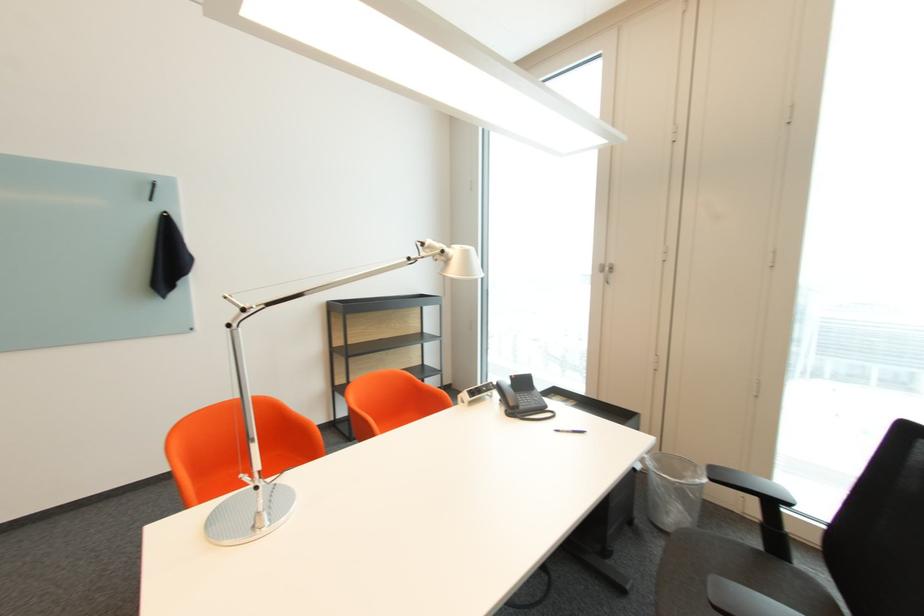
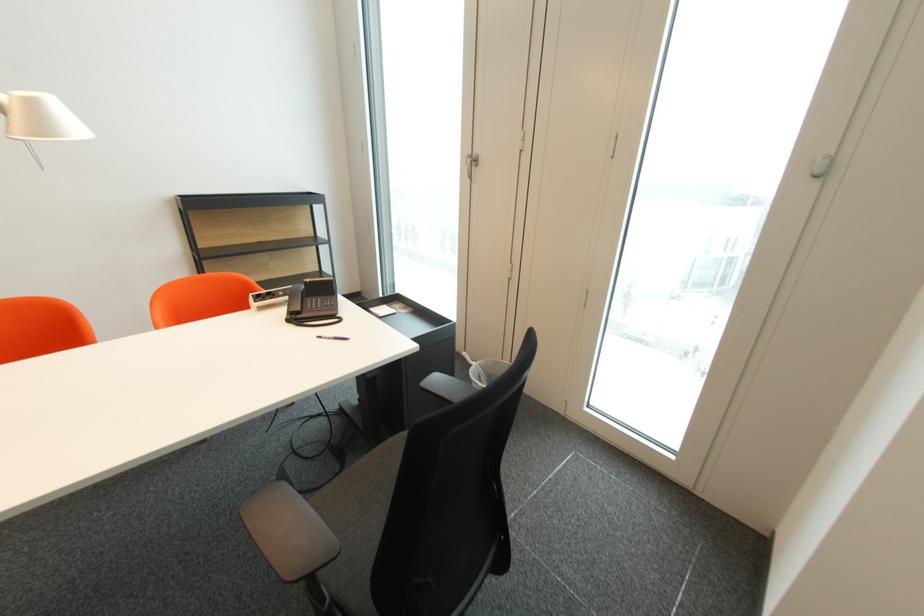
Locate, in the second image, the point that corresponds to pixel 492 389 in the first image.

(287, 294)